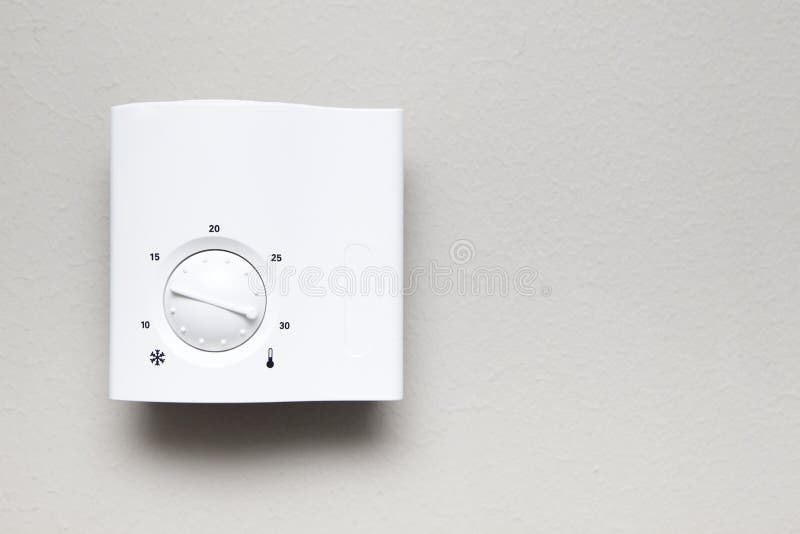
Where is `thermostat`? Image resolution: width=800 pixels, height=534 pixels. thermostat is located at coordinates (269, 365).